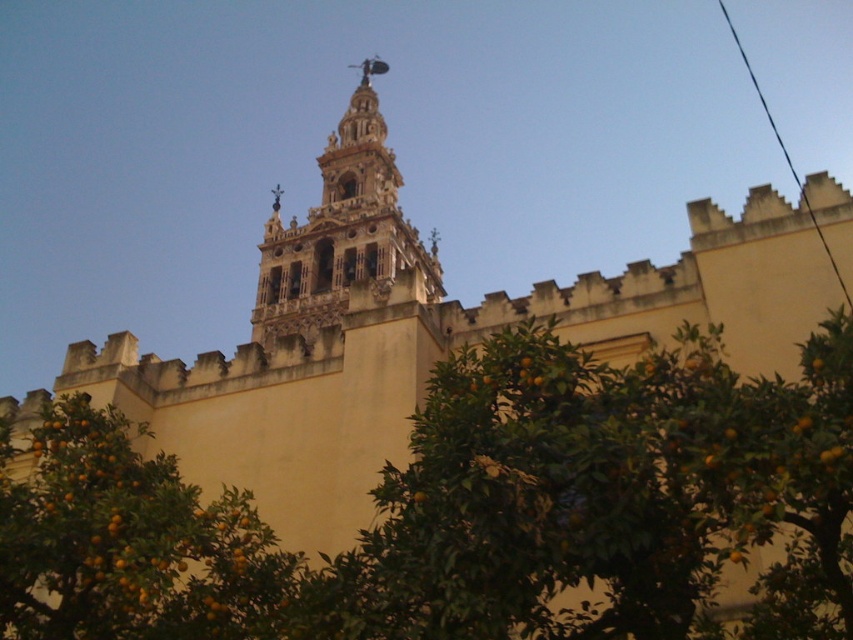
Question: Is orange matte at lower left to the left of golden stone church tower at center from the viewer's perspective?

Choices:
 (A) yes
 (B) no

Answer: (A)

Question: Which point appears closest to the camera in this image?

Choices:
 (A) (398, 221)
 (B) (47, 586)

Answer: (B)

Question: Which point is farther from the camera taking this photo?

Choices:
 (A) (78, 506)
 (B) (395, 180)

Answer: (B)

Question: Observing the image, what is the correct spatial positioning of orange matte at lower left in reference to golden stone church tower at center?

Choices:
 (A) below
 (B) above

Answer: (A)

Question: Can you confirm if orange matte at lower left is wider than golden stone church tower at center?

Choices:
 (A) no
 (B) yes

Answer: (A)